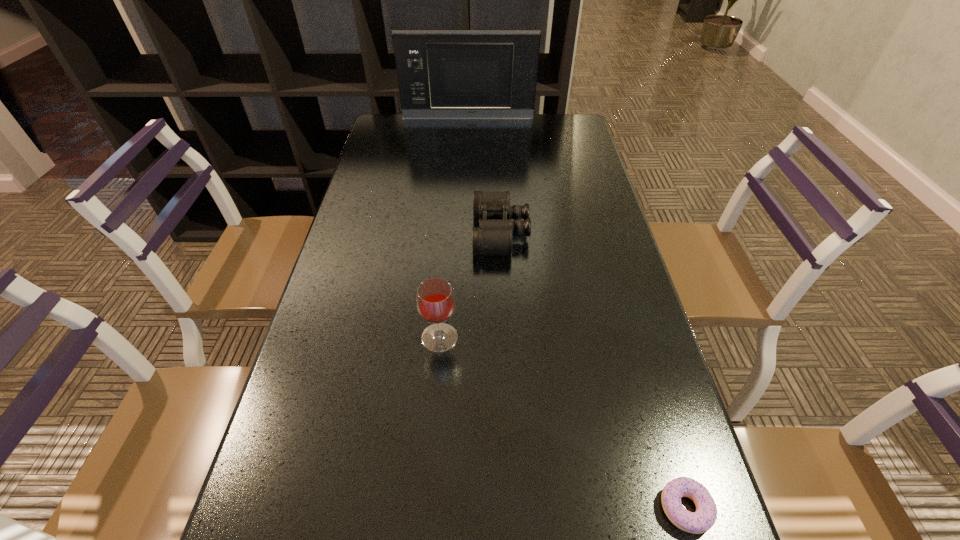
Find the location of a particular element. free space located 0.090m at the eyepieces of the second shortest object is located at coordinates (440, 232).

The height and width of the screenshot is (540, 960). Identify the location of vacant space located 0.190m at the eyepieces of the second shortest object. (403, 232).

Find the location of `vacant space located at the eyepieces of the second shortest object`. vacant space located at the eyepieces of the second shortest object is located at coordinates (433, 232).

Image resolution: width=960 pixels, height=540 pixels. In order to click on vacant space located on the back of the rightmost object in this screenshot , I will do `click(644, 369)`.

Identify the location of object that is at the far edge. (442, 74).

The height and width of the screenshot is (540, 960). I want to click on object that is at the left edge, so (x=442, y=74).

Locate an element on the screen. Image resolution: width=960 pixels, height=540 pixels. object that is at the right edge is located at coordinates (698, 522).

Locate an element on the screen. Image resolution: width=960 pixels, height=540 pixels. object at the far left corner is located at coordinates (442, 74).

The height and width of the screenshot is (540, 960). In the image, there is a desktop. Find the location of `free space at the far edge`. free space at the far edge is located at coordinates [x=430, y=129].

This screenshot has height=540, width=960. I want to click on vacant space at the left edge, so click(376, 160).